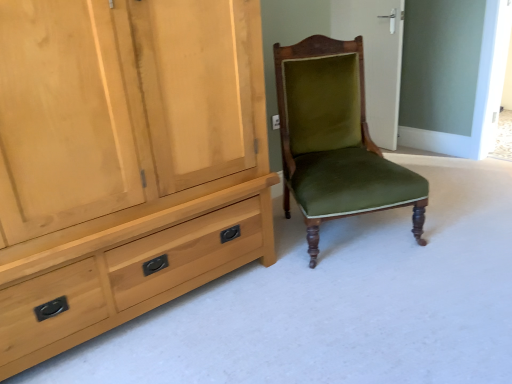
This screenshot has width=512, height=384. What do you see at coordinates (335, 139) in the screenshot?
I see `velvet green chair at center` at bounding box center [335, 139].

This screenshot has width=512, height=384. In order to click on green velvet chair at center in this screenshot , I will do `click(376, 58)`.

This screenshot has height=384, width=512. What are the coordinates of `light wood cabinet at left` in the screenshot? It's located at (124, 160).

Considering the sizes of objects velvet green chair at center and light wood cabinet at left in the image provided, who is bigger, velvet green chair at center or light wood cabinet at left?

light wood cabinet at left is bigger.

Considering the sizes of objects velvet green chair at center and light wood cabinet at left in the image provided, who is taller, velvet green chair at center or light wood cabinet at left?

light wood cabinet at left is taller.

From a real-world perspective, is velvet green chair at center physically above light wood cabinet at left?

Actually, velvet green chair at center is physically below light wood cabinet at left in the real world.

From a real-world perspective, is green velvet chair at center physically located above or below light wood cabinet at left?

In terms of real-world spatial position, green velvet chair at center is below light wood cabinet at left.

Would you say green velvet chair at center is outside light wood cabinet at left?

green velvet chair at center is positioned outside light wood cabinet at left.

Would you say green velvet chair at center is a long distance from light wood cabinet at left?

Yes, green velvet chair at center and light wood cabinet at left are located far from each other.

Considering the relative sizes of velvet green chair at center and green velvet chair at center in the image provided, is velvet green chair at center wider than green velvet chair at center?

Correct, the width of velvet green chair at center exceeds that of green velvet chair at center.

The height and width of the screenshot is (384, 512). There is a velvet green chair at center. Find the location of `screen door above it (from a real-world perspective)`. screen door above it (from a real-world perspective) is located at coordinates tap(376, 58).

Looking at this image, from a real-world perspective, is velvet green chair at center on top of green velvet chair at center?

No.

What's the angular difference between velvet green chair at center and green velvet chair at center's facing directions?

The angle between the facing direction of velvet green chair at center and the facing direction of green velvet chair at center is 69.2 degrees.

Is green velvet chair at center spatially inside velvet green chair at center, or outside of it?

green velvet chair at center is outside velvet green chair at center.

Considering the positions of objects green velvet chair at center and velvet green chair at center in the image provided, who is in front, green velvet chair at center or velvet green chair at center?

Positioned in front is velvet green chair at center.

From a real-world perspective, is green velvet chair at center on velvet green chair at center?

Correct, in the physical world, green velvet chair at center is higher than velvet green chair at center.

Based on the photo, considering the sizes of light wood cabinet at left and velvet green chair at center in the image, is light wood cabinet at left wider or thinner than velvet green chair at center?

In the image, light wood cabinet at left appears to be more narrow than velvet green chair at center.

Is velvet green chair at center surrounded by light wood cabinet at left?

No, light wood cabinet at left does not contain velvet green chair at center.

Which object is closer to the camera, light wood cabinet at left or velvet green chair at center?

Positioned in front is light wood cabinet at left.

Is light wood cabinet at left wider or thinner than green velvet chair at center?

Considering their sizes, light wood cabinet at left looks broader than green velvet chair at center.

From the image's perspective, is light wood cabinet at left beneath green velvet chair at center?

Correct, light wood cabinet at left appears lower than green velvet chair at center in the image.

How many degrees apart are the facing directions of light wood cabinet at left and green velvet chair at center?

light wood cabinet at left and green velvet chair at center are facing 95 degrees away from each other.

Where is `chair to the right of light wood cabinet at left`? The height and width of the screenshot is (384, 512). chair to the right of light wood cabinet at left is located at coordinates (335, 139).

What are the coordinates of `screen door below the light wood cabinet at left (from a real-world perspective)` in the screenshot? It's located at (376, 58).

Based on the photo, estimate the real-world distances between objects in this image. Which object is closer to velvet green chair at center, green velvet chair at center or light wood cabinet at left?

The object closer to velvet green chair at center is light wood cabinet at left.

Estimate the real-world distances between objects in this image. Which object is closer to green velvet chair at center, light wood cabinet at left or velvet green chair at center?

The object closer to green velvet chair at center is velvet green chair at center.

Looking at this image, from the image, which object appears to be nearer to light wood cabinet at left, velvet green chair at center or green velvet chair at center?

The object closer to light wood cabinet at left is velvet green chair at center.

Estimate the real-world distances between objects in this image. Which object is further from velvet green chair at center, light wood cabinet at left or green velvet chair at center?

green velvet chair at center is positioned further to the anchor velvet green chair at center.

Based on their spatial positions, is velvet green chair at center or light wood cabinet at left further from green velvet chair at center?

Based on the image, light wood cabinet at left appears to be further to green velvet chair at center.

Estimate the real-world distances between objects in this image. Which object is closer to light wood cabinet at left, green velvet chair at center or velvet green chair at center?

velvet green chair at center is positioned closer to the anchor light wood cabinet at left.

I want to click on chair between light wood cabinet at left and green velvet chair at center along the z-axis, so click(x=335, y=139).